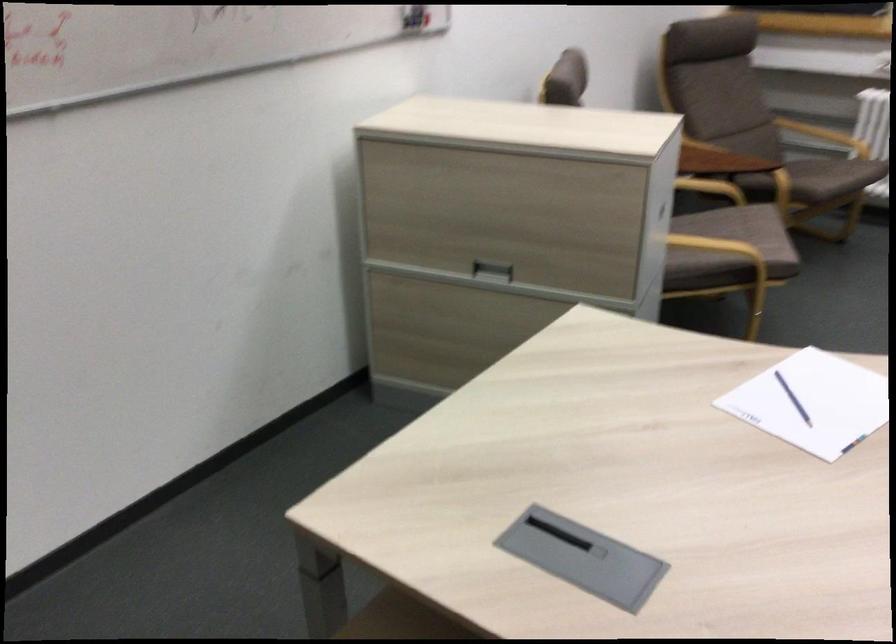
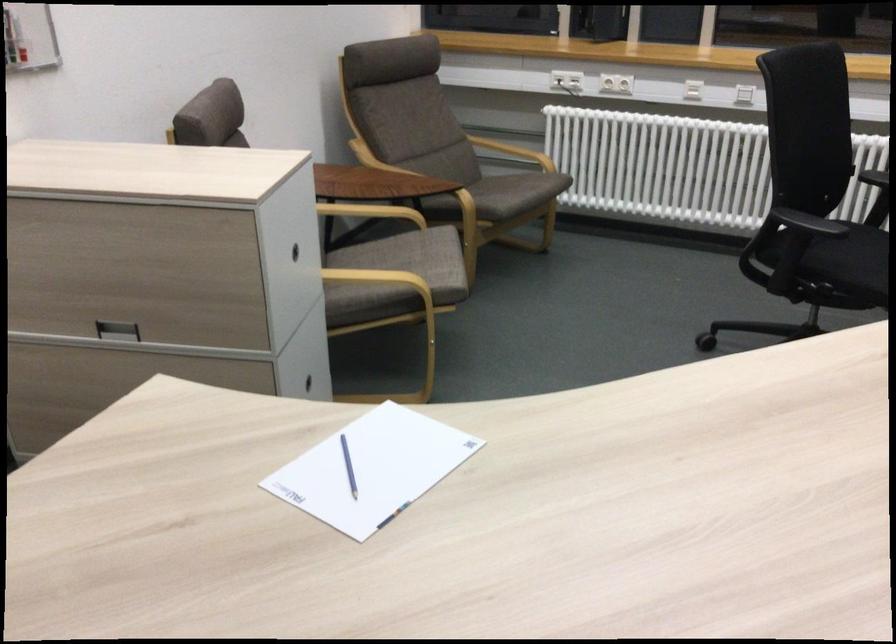
The point at [485,267] is marked in the first image. Where is the corresponding point in the second image?

(116, 330)